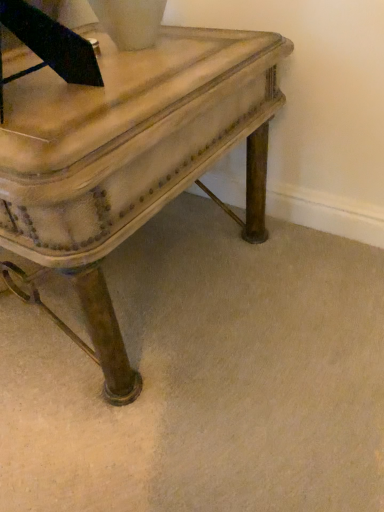
What are the coordinates of `free spot above wooden table at center (from a real-world perspective)` in the screenshot? It's located at (111, 72).